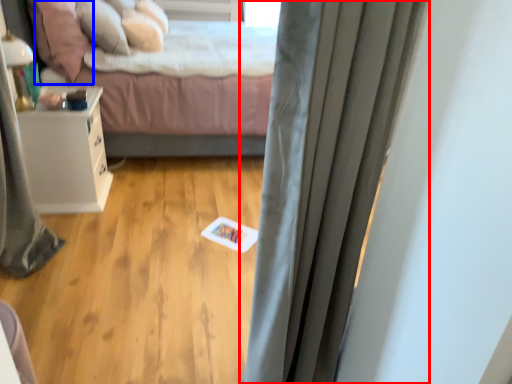
Question: Which object appears closest to the camera in this image, curtain (highlighted by a red box) or pillow (highlighted by a blue box)?

Choices:
 (A) curtain
 (B) pillow

Answer: (A)